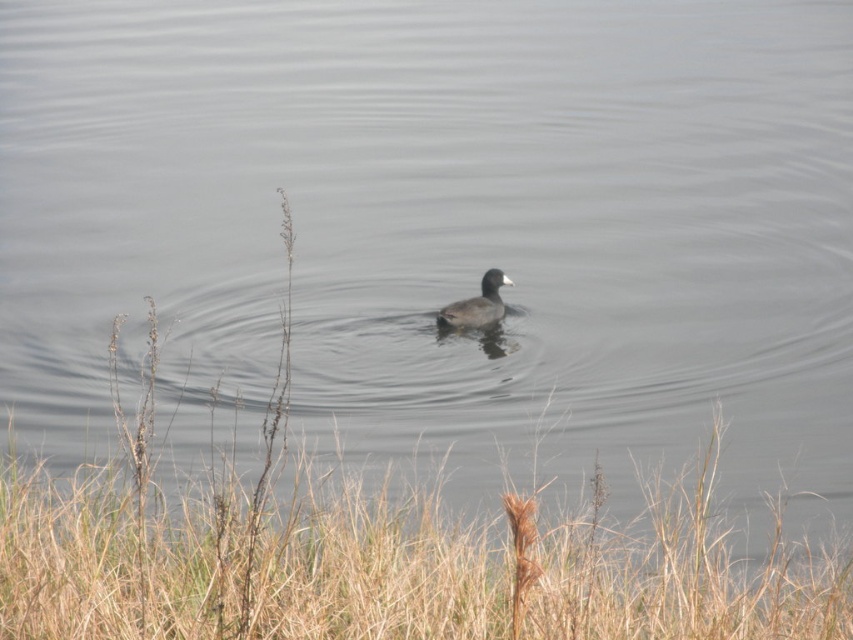
You are standing in the scene and want to place a small flag at each of the two points labeled point (83, 506) and point (462, 326). Which point will require you to walk further away from your current position to reach?

Point (462, 326) will require you to walk further away from your current position because it is farther from the viewer compared to point (83, 506).

You are standing at the edge of the lake and see the dry grass at lower center and the dark brown feathers at center. Which object is closer to you?

The dry grass at lower center is closer to you since it is only 3.24 meters away from the dark brown feathers at center, which are further away.

You are a photographer trying to capture the bird with the dark brown feathers at center. You notice the dry grass at lower center is blocking your view. Can you adjust your position to get a clearer shot of the bird without the dry grass obstructing the view?

The dry grass at lower center is closer to the viewer than the dark brown feathers at center, so moving your position slightly to the side or adjusting your angle might allow you to position the bird in front of the grass, reducing obstruction.